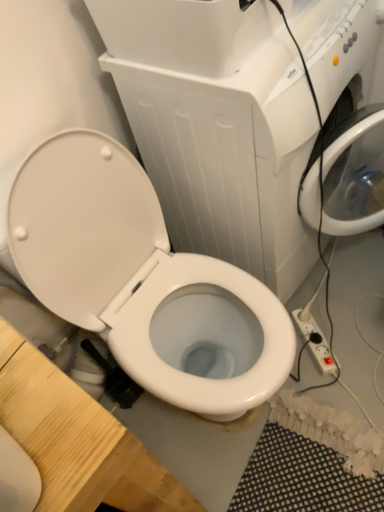
In order to face white glossy toilet at center, should I rotate leftwards or rightwards?

A 11.062 degree turn to the right will do.

Locate an element on the screen. The height and width of the screenshot is (512, 384). white glossy toilet at center is located at coordinates (135, 273).

Locate an element on the screen. This screenshot has height=512, width=384. white glossy toilet at center is located at coordinates (218, 126).

From a real-world perspective, which is physically above, white glossy toilet at center or white glossy toilet at center?

white glossy toilet at center.

Is white glossy toilet at center oriented away from white glossy toilet at center?

No, white glossy toilet at center is not facing the opposite direction of white glossy toilet at center.

How different are the orientations of white glossy toilet at center and white glossy toilet at center in degrees?

white glossy toilet at center and white glossy toilet at center are facing 6.5 degrees away from each other.

What's the angular difference between white glossy toilet at center and white plastic power strip at lower right's facing directions?

The facing directions of white glossy toilet at center and white plastic power strip at lower right are 38.1 degrees apart.

Considering the points (214, 199) and (302, 321), which point is behind, point (214, 199) or point (302, 321)?

The point (302, 321) is more distant.

Would you say white glossy toilet at center is inside or outside white plastic power strip at lower right?

white glossy toilet at center exists outside the volume of white plastic power strip at lower right.

The image size is (384, 512). I want to click on electric outlet that appears below the white glossy toilet at center (from a real-world perspective), so click(315, 343).

Considering the sizes of objects white glossy toilet at center and white glossy toilet at center in the image provided, who is shorter, white glossy toilet at center or white glossy toilet at center?

Standing shorter between the two is white glossy toilet at center.

From a real-world perspective, relative to white glossy toilet at center, is white glossy toilet at center vertically above or below?

From a real-world perspective, white glossy toilet at center is physically below white glossy toilet at center.

Is white glossy toilet at center positioned far away from white glossy toilet at center?

They are positioned close to each other.

Is white glossy toilet at center to the left or to the right of white glossy toilet at center in the image?

In the image, white glossy toilet at center appears on the left side of white glossy toilet at center.

From a real-world perspective, which object stands above the other?

white glossy toilet at center.

Which of these two, white glossy toilet at center or white plastic power strip at lower right, stands shorter?

Standing shorter between the two is white plastic power strip at lower right.

Are white glossy toilet at center and white plastic power strip at lower right far apart?

No, white glossy toilet at center is in close proximity to white plastic power strip at lower right.

From a real-world perspective, who is located lower, white plastic power strip at lower right or white glossy toilet at center?

In real-world perspective, white plastic power strip at lower right is lower.

In the scene shown: From the image's perspective, is white plastic power strip at lower right above white glossy toilet at center?

No, from the image's perspective, white plastic power strip at lower right is not above white glossy toilet at center.

Based on the photo, is white plastic power strip at lower right touching white glossy toilet at center?

No, white plastic power strip at lower right is not next to white glossy toilet at center.

Is white plastic power strip at lower right taller than white glossy toilet at center?

In fact, white plastic power strip at lower right may be shorter than white glossy toilet at center.

From the picture: Is white plastic power strip at lower right oriented towards white glossy toilet at center?

No, white plastic power strip at lower right is not oriented towards white glossy toilet at center.

How different are the orientations of white plastic power strip at lower right and white glossy toilet at center in degrees?

They differ by 31.6 degrees in their facing directions.

Identify the location of toilet below the white glossy toilet at center (from a real-world perspective). (135, 273).

This screenshot has height=512, width=384. What are the coordinates of `electric outlet below the white glossy toilet at center (from the image's perspective)` in the screenshot? It's located at (315, 343).

When comparing their distances from white glossy toilet at center, does white plastic power strip at lower right or white glossy toilet at center seem further?

white plastic power strip at lower right lies further to white glossy toilet at center than the other object.

Based on their spatial positions, is white glossy toilet at center or white glossy toilet at center closer to white plastic power strip at lower right?

white glossy toilet at center is positioned closer to the anchor white plastic power strip at lower right.

Which object lies nearer to the anchor point white glossy toilet at center, white plastic power strip at lower right or white glossy toilet at center?

white glossy toilet at center is closer to white glossy toilet at center.

When comparing their distances from white plastic power strip at lower right, does white glossy toilet at center or white glossy toilet at center seem closer?

Among the two, white glossy toilet at center is located nearer to white plastic power strip at lower right.

Which object lies further to the anchor point white glossy toilet at center, white glossy toilet at center or white plastic power strip at lower right?

Based on the image, white plastic power strip at lower right appears to be further to white glossy toilet at center.

Considering their positions, is white glossy toilet at center positioned closer to white glossy toilet at center than white plastic power strip at lower right?

Among the two, white glossy toilet at center is located nearer to white glossy toilet at center.

This screenshot has width=384, height=512. What are the coordinates of `appliance located between white glossy toilet at center and white plastic power strip at lower right in the depth direction` in the screenshot? It's located at (218, 126).